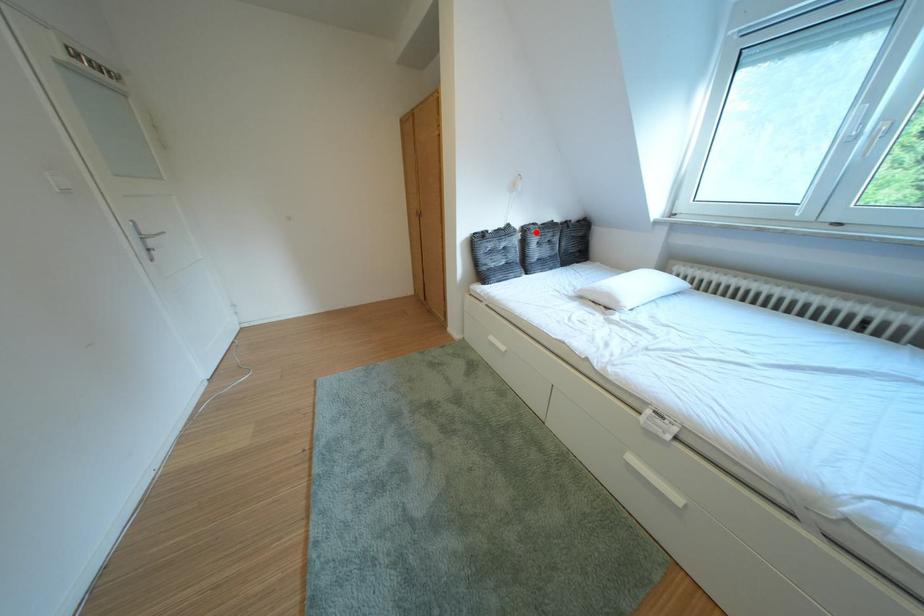
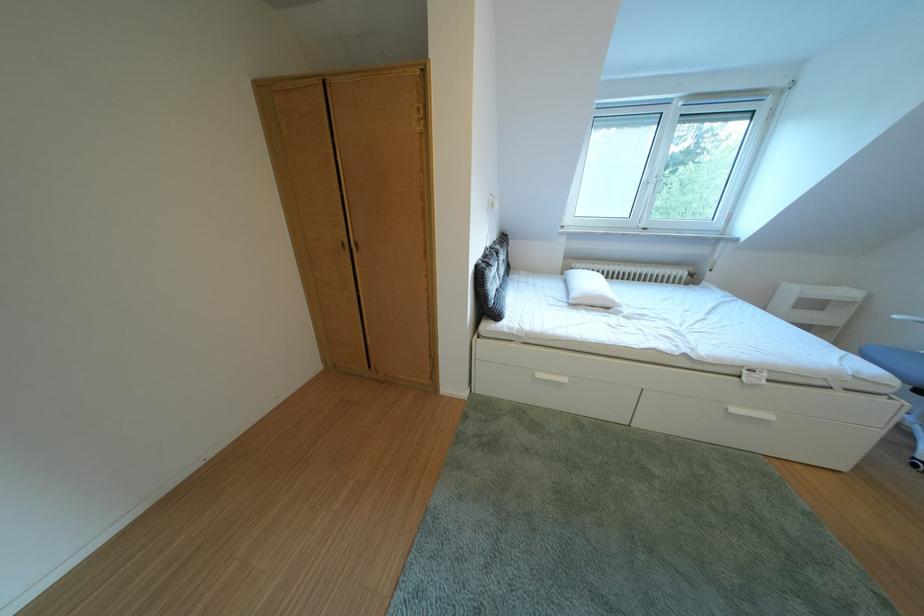
Where in the second image is the point corresponding to the highlighted location from the first image?

(505, 254)